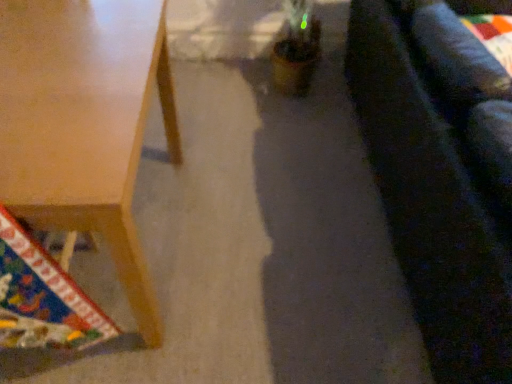
Image resolution: width=512 pixels, height=384 pixels. What do you see at coordinates (433, 199) in the screenshot?
I see `dark blue fabric couch at right` at bounding box center [433, 199].

This screenshot has height=384, width=512. Find the location of `dark blue fabric couch at right`. dark blue fabric couch at right is located at coordinates (433, 199).

Where is `light brown wooden table at lower left`? light brown wooden table at lower left is located at coordinates (84, 123).

This screenshot has width=512, height=384. What do you see at coordinates (84, 123) in the screenshot? I see `light brown wooden table at lower left` at bounding box center [84, 123].

Image resolution: width=512 pixels, height=384 pixels. In order to click on dark blue fabric couch at right in this screenshot , I will do `click(433, 199)`.

Considering the positions of objects dark blue fabric couch at right and light brown wooden table at lower left in the image provided, who is more to the left, dark blue fabric couch at right or light brown wooden table at lower left?

Positioned to the left is light brown wooden table at lower left.

Is dark blue fabric couch at right in front of or behind light brown wooden table at lower left in the image?

Visually, dark blue fabric couch at right is located in front of light brown wooden table at lower left.

Does point (474, 352) come closer to viewer compared to point (45, 88)?

Yes, it is in front of point (45, 88).

From the image's perspective, relative to light brown wooden table at lower left, is dark blue fabric couch at right above or below?

Based on their image positions, dark blue fabric couch at right is located above light brown wooden table at lower left.

From a real-world perspective, who is located higher, dark blue fabric couch at right or light brown wooden table at lower left?

From a 3D spatial view, dark blue fabric couch at right is above.

Which of these two, dark blue fabric couch at right or light brown wooden table at lower left, is thinner?

With smaller width is light brown wooden table at lower left.

Between dark blue fabric couch at right and light brown wooden table at lower left, which one has less height?

With less height is light brown wooden table at lower left.

Considering the relative sizes of dark blue fabric couch at right and light brown wooden table at lower left in the image provided, is dark blue fabric couch at right bigger than light brown wooden table at lower left?

Indeed, dark blue fabric couch at right has a larger size compared to light brown wooden table at lower left.

Is light brown wooden table at lower left a part of dark blue fabric couch at right?

No, light brown wooden table at lower left is not a part of dark blue fabric couch at right.

Does dark blue fabric couch at right touch light brown wooden table at lower left?

dark blue fabric couch at right and light brown wooden table at lower left are not in contact.

In the scene shown: Is dark blue fabric couch at right looking in the opposite direction of light brown wooden table at lower left?

That's right, dark blue fabric couch at right is facing away from light brown wooden table at lower left.

Can you tell me how much dark blue fabric couch at right and light brown wooden table at lower left differ in facing direction?

0.73 degrees separate the facing orientations of dark blue fabric couch at right and light brown wooden table at lower left.

Find the location of a particular element. This screenshot has width=512, height=384. couch positioned vertically above the light brown wooden table at lower left (from a real-world perspective) is located at coordinates (433, 199).

Considering the relative positions of light brown wooden table at lower left and dark blue fabric couch at right in the image provided, is light brown wooden table at lower left to the left or to the right of dark blue fabric couch at right?

light brown wooden table at lower left is positioned on dark blue fabric couch at right's left side.

Which is in front, light brown wooden table at lower left or dark blue fabric couch at right?

Positioned in front is dark blue fabric couch at right.

Which is in front, point (7, 163) or point (489, 220)?

The point (7, 163) is more forward.

From the image's perspective, is light brown wooden table at lower left above or below dark blue fabric couch at right?

Clearly, from the image's perspective, light brown wooden table at lower left is below dark blue fabric couch at right.

From a real-world perspective, is light brown wooden table at lower left beneath dark blue fabric couch at right?

Yes, from a real-world perspective, light brown wooden table at lower left is under dark blue fabric couch at right.

Considering the sizes of objects light brown wooden table at lower left and dark blue fabric couch at right in the image provided, who is thinner, light brown wooden table at lower left or dark blue fabric couch at right?

With smaller width is light brown wooden table at lower left.

Considering the sizes of light brown wooden table at lower left and dark blue fabric couch at right in the image, is light brown wooden table at lower left taller or shorter than dark blue fabric couch at right?

light brown wooden table at lower left is shorter than dark blue fabric couch at right.

Is light brown wooden table at lower left bigger than dark blue fabric couch at right?

No.

Would you say light brown wooden table at lower left contains dark blue fabric couch at right?

No, dark blue fabric couch at right is not surrounded by light brown wooden table at lower left.

Are light brown wooden table at lower left and dark blue fabric couch at right making contact?

light brown wooden table at lower left and dark blue fabric couch at right are not in contact.

Could you tell me if light brown wooden table at lower left is turned towards dark blue fabric couch at right?

Yes.

At what (x,y) coordinates should I click in order to perform the action: click on table below the dark blue fabric couch at right (from a real-world perspective). Please return your answer as a coordinate pair (x, y). The height and width of the screenshot is (384, 512). Looking at the image, I should click on (84, 123).

In order to click on couch that is on the right side of light brown wooden table at lower left in this screenshot , I will do `click(433, 199)`.

The height and width of the screenshot is (384, 512). I want to click on table that is under the dark blue fabric couch at right (from a real-world perspective), so click(x=84, y=123).